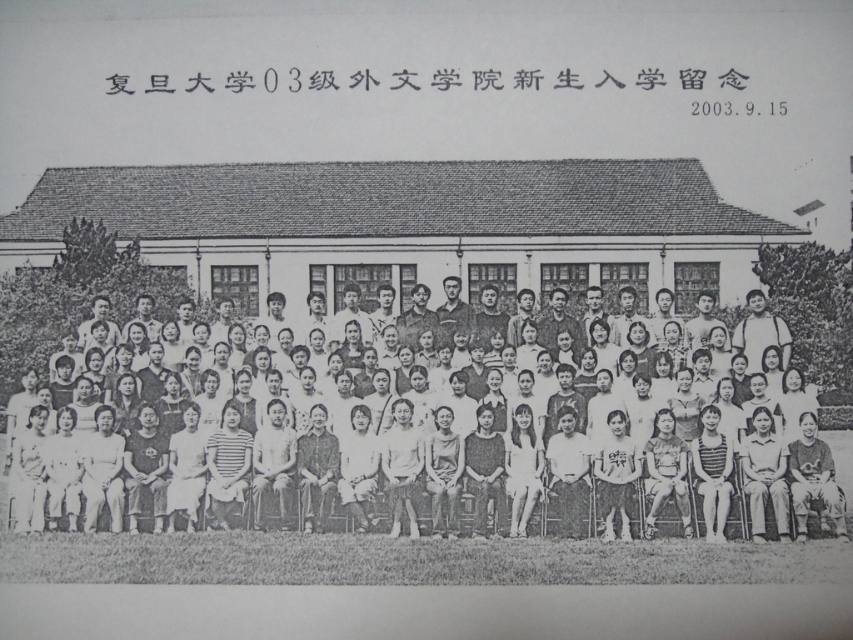
You are a photographer reviewing this image. You notice the black paper at upper center and the white cotton shirt at center. Which object is positioned more to the right side of the image?

The black paper at upper center is positioned more to the right side of the image than the white cotton shirt at center.

You are a photographer reviewing this group photo from 2003. You notice two items in the image. One is the black paper at upper center and the other is the white cotton shirt at center. Which of these two items is smaller in size?

The black paper at upper center has a smaller size compared to the white cotton shirt at center, so the black paper at upper center is the smaller item.

You are a photographer who needs to adjust the lighting for the group photo. You notice the black paper at upper center and the white cotton shirt at center. Which object is closer to the camera, and why?

The black paper at upper center is closer to the camera because the white cotton shirt at center is behind it.